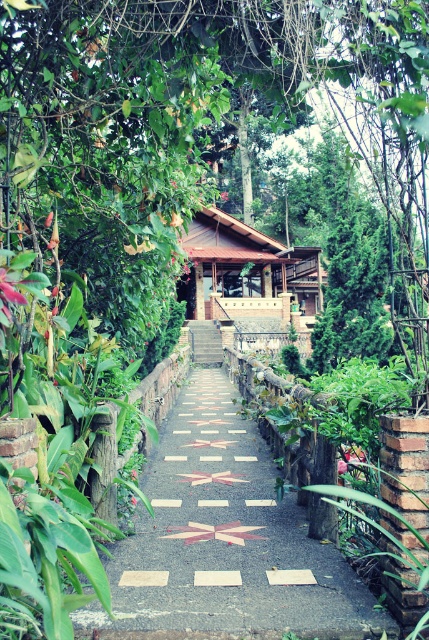
Consider the image. Is green leafy tree at upper left positioned at the back of marble-patterned stone path at center?

No, it is not.

This screenshot has height=640, width=429. Describe the element at coordinates (214, 154) in the screenshot. I see `green leafy tree at upper left` at that location.

Find the location of a particular element. green leafy tree at upper left is located at coordinates (214, 154).

Which of these two, green leafy tree at upper left or brown wooden hut at center, stands shorter?

Standing shorter between the two is brown wooden hut at center.

Is point (33, 60) positioned before point (247, 244)?

Yes, point (33, 60) is closer to viewer.

Which is in front, point (386, 268) or point (292, 269)?

Positioned in front is point (386, 268).

Identify the location of green leafy tree at upper left. (214, 154).

Where is `brown wooden hut at center`? The height and width of the screenshot is (640, 429). brown wooden hut at center is located at coordinates (250, 282).

Is brown wooden hut at center closer to camera compared to wooden stairs at center?

Yes.

Describe the element at coordinates (250, 282) in the screenshot. I see `brown wooden hut at center` at that location.

Locate an element on the screen. brown wooden hut at center is located at coordinates 250,282.